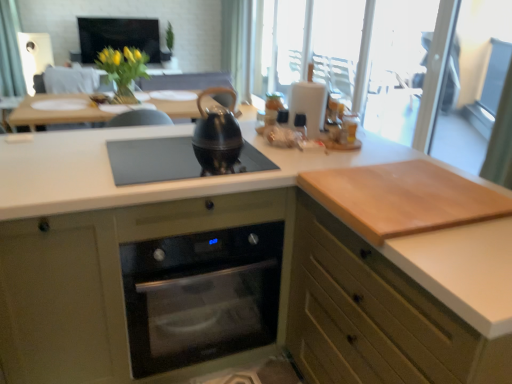
At what (x,y) coordinates should I click in order to perform the action: click on vacant space situated above olive green wood oven at center, the 1th cabinetry when ordered from left to right (from a real-world perspective). Please return your answer as a coordinate pair (x, y). This screenshot has width=512, height=384. Looking at the image, I should click on (135, 145).